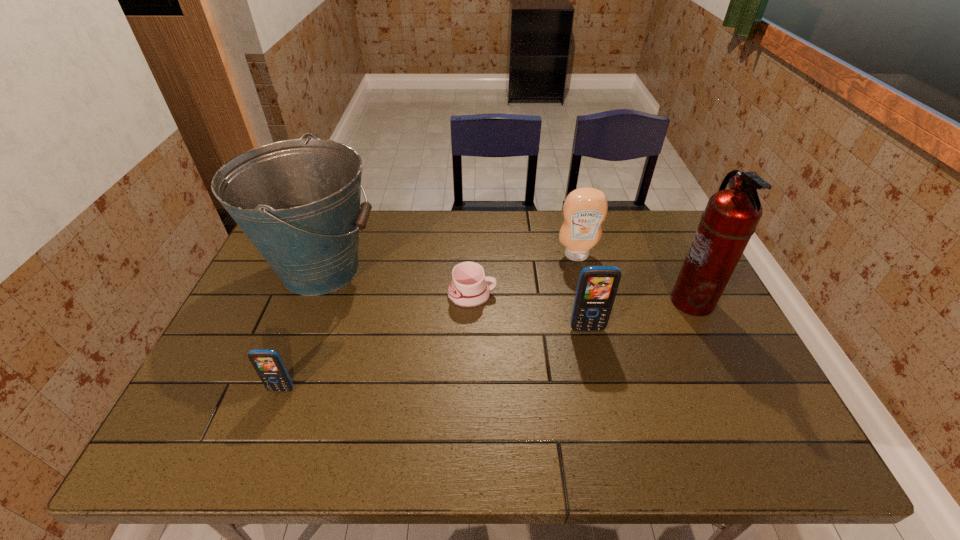
Locate an element on the screen. This screenshot has height=540, width=960. vacant area that lies between the fire extinguisher and the bucket is located at coordinates (506, 285).

Image resolution: width=960 pixels, height=540 pixels. I want to click on empty space between the mug and the fifth tallest object, so click(377, 342).

Identify the location of vacant point located between the farther cellular telephone and the mug. This screenshot has width=960, height=540. (530, 312).

At what (x,y) coordinates should I click in order to perform the action: click on vacant region between the rightmost object and the bucket. Please return your answer as a coordinate pair (x, y). This screenshot has width=960, height=540. Looking at the image, I should click on (506, 285).

Locate an element on the screen. vacant space in between the condiment and the bucket is located at coordinates (449, 262).

Find the location of a particular element. This screenshot has width=960, height=540. unoccupied position between the fire extinguisher and the shorter cellular telephone is located at coordinates (487, 346).

Locate an element on the screen. the fourth closest object relative to the rightmost object is located at coordinates (298, 201).

Where is `object that ranks as the fifth closest to the tallest object`? object that ranks as the fifth closest to the tallest object is located at coordinates (268, 364).

Find the location of a particular element. blank space that satisfies the following two spatial constraints: 1. on the side with the handle of the third object from left to right; 2. on the screen of the nearer cellular telephone is located at coordinates (470, 389).

This screenshot has width=960, height=540. Identify the location of blank space that satisfies the following two spatial constraints: 1. on the label of the condiment; 2. with the handle on opposite sides of the bucket. (580, 269).